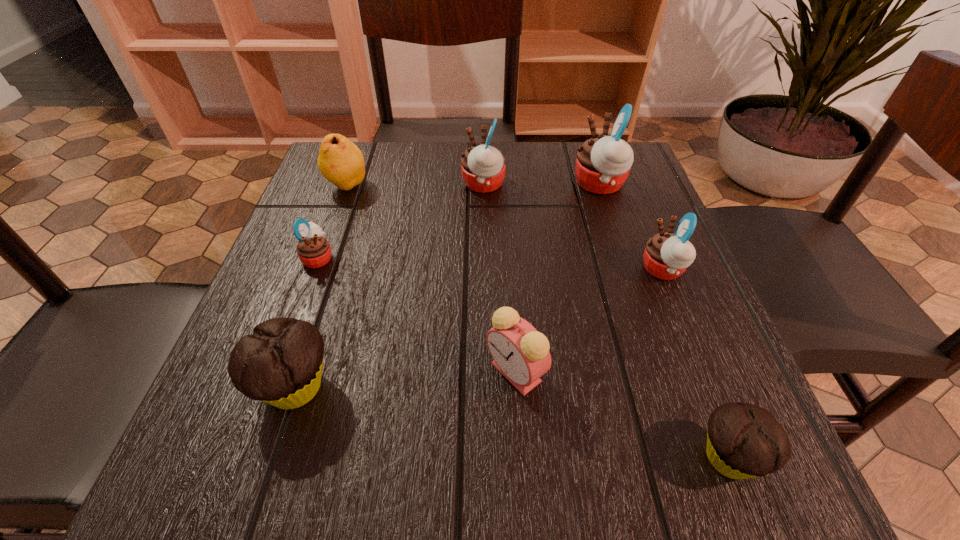
Where is `free area in between the bigger chocolate muffin and the pear`? The width and height of the screenshot is (960, 540). free area in between the bigger chocolate muffin and the pear is located at coordinates 321,287.

Locate an element on the screen. empty space that is in between the alarm clock and the smaller chocolate muffin is located at coordinates (622, 415).

Locate an element on the screen. The image size is (960, 540). free point between the third biggest pink muffin and the right chocolate muffin is located at coordinates (696, 363).

Locate an element on the screen. This screenshot has width=960, height=540. empty location between the second smallest pink muffin and the left chocolate muffin is located at coordinates (479, 329).

Locate an element on the screen. The height and width of the screenshot is (540, 960). empty space between the pink alarm clock and the tallest object is located at coordinates 558,279.

Locate an element on the screen. vacant space that's between the right chocolate muffin and the third muffin from left to right is located at coordinates (606, 321).

Locate an element on the screen. The image size is (960, 540). free space between the bigger chocolate muffin and the second smallest pink muffin is located at coordinates (479, 329).

Where is `free area in between the smaller chocolate muffin and the tallest muffin`? The image size is (960, 540). free area in between the smaller chocolate muffin and the tallest muffin is located at coordinates (664, 321).

Image resolution: width=960 pixels, height=540 pixels. Identify the location of object identified as the sixth closest to the smaller chocolate muffin. (314, 251).

You are a GUI agent. You are given a task and a screenshot of the screen. Output one action in this format:
    pyautogui.click(x=<x>, y=<y>)
    Task: Click on the object that is the third nearest to the pink alarm clock
    Image resolution: width=960 pixels, height=540 pixels.
    Given the screenshot: What is the action you would take?
    pyautogui.click(x=667, y=255)